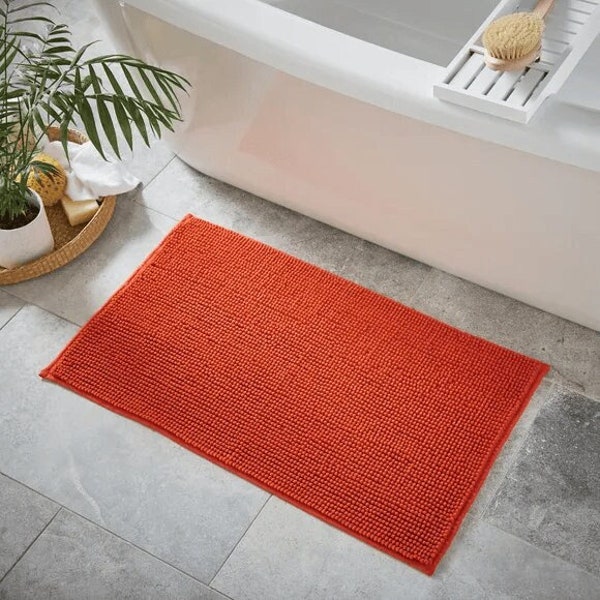
The image size is (600, 600). What are the coordinates of `gray floor tiles` in the screenshot? It's located at (123, 510), (552, 460), (473, 575).